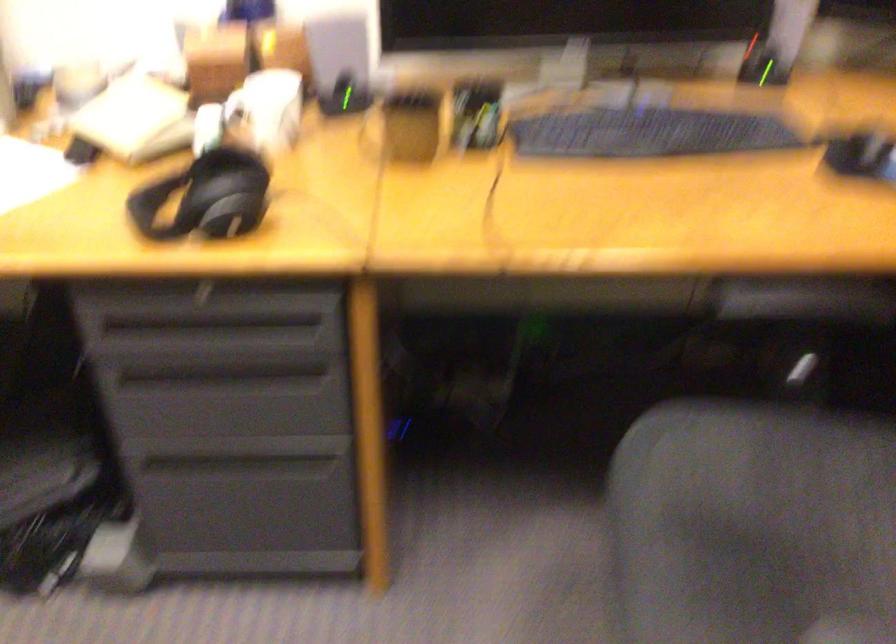
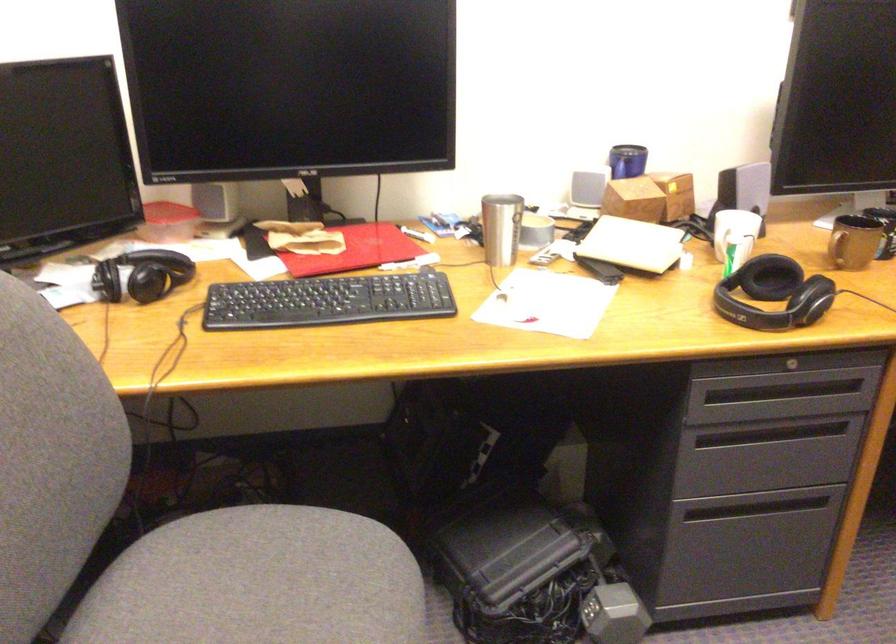
In the second image, find the point that corresponds to [392,140] in the first image.

(854, 242)